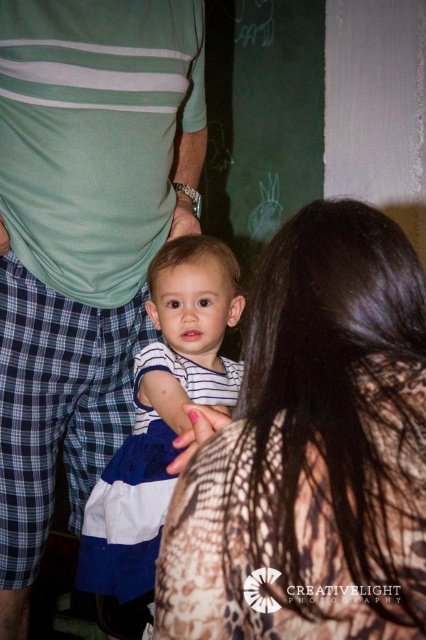
Question: Which of the following is the closest to the observer?

Choices:
 (A) (172, 467)
 (B) (175, 193)
 (C) (118, 362)

Answer: (A)

Question: Which is farther from the white striped shirt at center?

Choices:
 (A) matte skin hand at center
 (B) green striped shirt at center
 (C) brown textured dress at center

Answer: (A)

Question: Does pink matte nail polish at center appear on the left side of matte skin hand at center?

Choices:
 (A) yes
 (B) no

Answer: (B)

Question: Is green striped shirt at center above white striped shirt at center?

Choices:
 (A) yes
 (B) no

Answer: (A)

Question: Is the position of white striped shirt at center less distant than that of pink matte nail polish at center?

Choices:
 (A) yes
 (B) no

Answer: (B)

Question: Which of the following is the closest to the observer?

Choices:
 (A) (189, 218)
 (B) (129, 172)
 (C) (184, 637)
 (D) (181, 449)

Answer: (C)